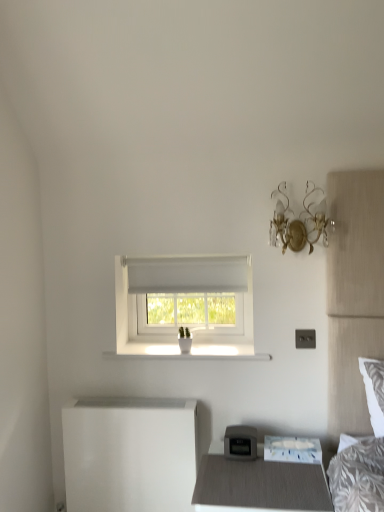
Question: Can you confirm if white glossy changing table at lower left is smaller than matte gray nightstand at lower center?

Choices:
 (A) yes
 (B) no

Answer: (A)

Question: Can you confirm if white glossy changing table at lower left is shorter than matte gray nightstand at lower center?

Choices:
 (A) no
 (B) yes

Answer: (A)

Question: Is the depth of white glossy changing table at lower left greater than that of matte gray nightstand at lower center?

Choices:
 (A) yes
 (B) no

Answer: (A)

Question: Is white glossy changing table at lower left positioned far away from matte gray nightstand at lower center?

Choices:
 (A) no
 (B) yes

Answer: (A)

Question: Considering the relative sizes of white glossy changing table at lower left and matte gray nightstand at lower center in the image provided, is white glossy changing table at lower left wider than matte gray nightstand at lower center?

Choices:
 (A) yes
 (B) no

Answer: (B)

Question: Looking at the image, does white fabric window at center seem bigger or smaller compared to white smooth window sill at center?

Choices:
 (A) big
 (B) small

Answer: (A)

Question: In terms of width, does white fabric window at center look wider or thinner when compared to white smooth window sill at center?

Choices:
 (A) wide
 (B) thin

Answer: (A)

Question: From the image's perspective, is white fabric window at center located above or below white smooth window sill at center?

Choices:
 (A) below
 (B) above

Answer: (B)

Question: Based on their positions, is white fabric window at center located to the left or right of white smooth window sill at center?

Choices:
 (A) right
 (B) left

Answer: (B)

Question: From a real-world perspective, is white fabric window at center physically located above or below white glossy changing table at lower left?

Choices:
 (A) above
 (B) below

Answer: (A)

Question: In the image, is white fabric window at center positioned in front of or behind white glossy changing table at lower left?

Choices:
 (A) behind
 (B) front

Answer: (A)

Question: From the image's perspective, relative to white glossy changing table at lower left, is white fabric window at center above or below?

Choices:
 (A) above
 (B) below

Answer: (A)

Question: In terms of width, does white fabric window at center look wider or thinner when compared to white glossy changing table at lower left?

Choices:
 (A) thin
 (B) wide

Answer: (B)

Question: In terms of width, does white smooth window sill at center look wider or thinner when compared to matte gray nightstand at lower center?

Choices:
 (A) thin
 (B) wide

Answer: (A)

Question: Is white smooth window sill at center to the left or to the right of matte gray nightstand at lower center in the image?

Choices:
 (A) right
 (B) left

Answer: (B)